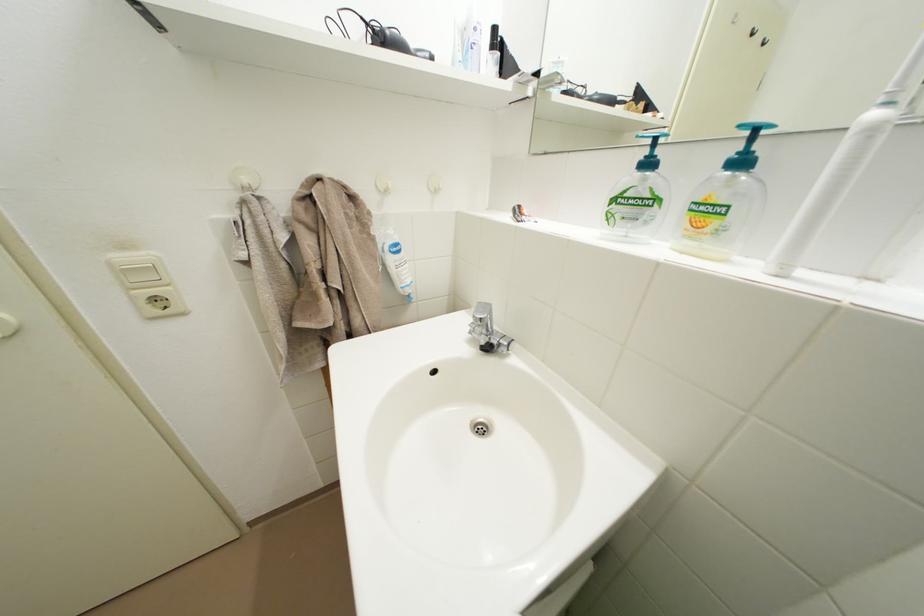
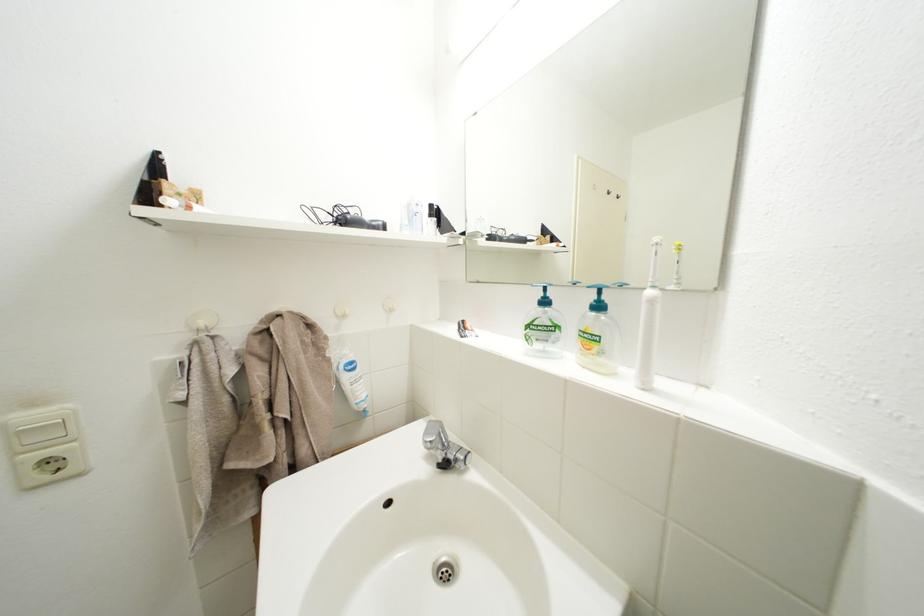
Where in the second image is the point corresponding to (650,164) from the first image?

(550, 302)